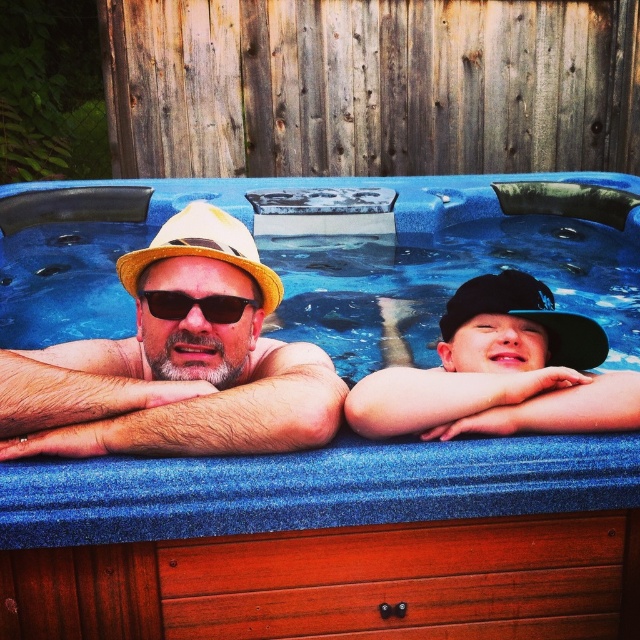
Does matte yellow hat at left have a smaller size compared to wooden drawer at lower center?

No.

Is matte yellow hat at left wider than wooden drawer at lower center?

In fact, matte yellow hat at left might be narrower than wooden drawer at lower center.

Where is `matte yellow hat at left`? This screenshot has height=640, width=640. matte yellow hat at left is located at coordinates tap(177, 362).

Is point (502, 598) farther from viewer compared to point (198, 307)?

No, it is not.

This screenshot has height=640, width=640. Describe the element at coordinates (401, 580) in the screenshot. I see `wooden drawer at lower center` at that location.

Locate an element on the screen. The height and width of the screenshot is (640, 640). wooden drawer at lower center is located at coordinates (401, 580).

Where is `wooden drawer at lower center`? Image resolution: width=640 pixels, height=640 pixels. wooden drawer at lower center is located at coordinates (401, 580).

Who is lower down, matte yellow hat at left or beige straw cowboy hat at center?

Positioned lower is matte yellow hat at left.

Does matte yellow hat at left appear on the right side of beige straw cowboy hat at center?

No, matte yellow hat at left is not to the right of beige straw cowboy hat at center.

Find the location of a particular element. matte yellow hat at left is located at coordinates (x=177, y=362).